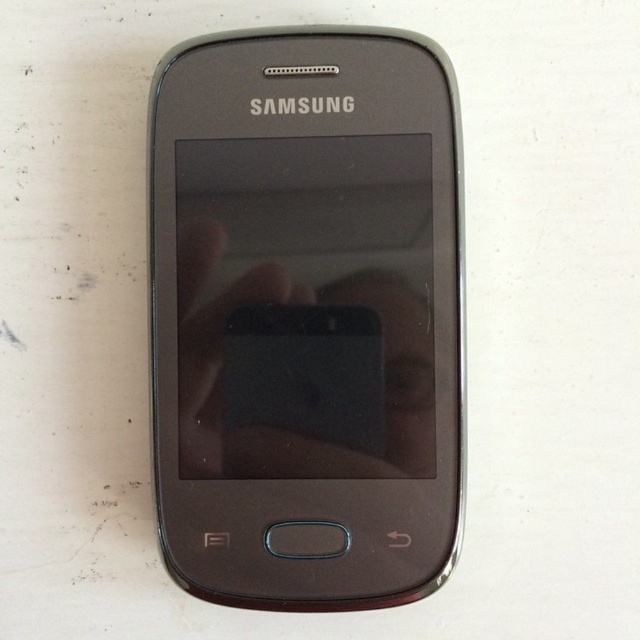
Which is in front, point (236, 392) or point (252, 300)?

Positioned in front is point (236, 392).

Is point (392, 529) more distant than point (188, 282)?

No, it is not.

Locate an element on the screen. matte black smartphone at center is located at coordinates (307, 316).